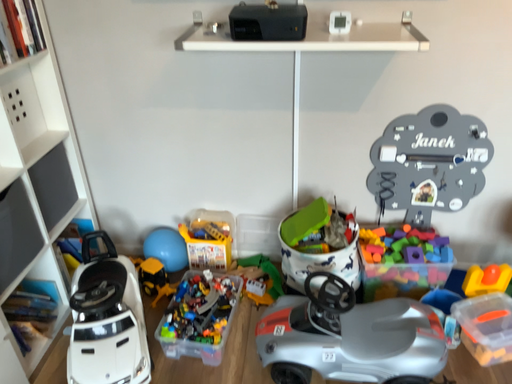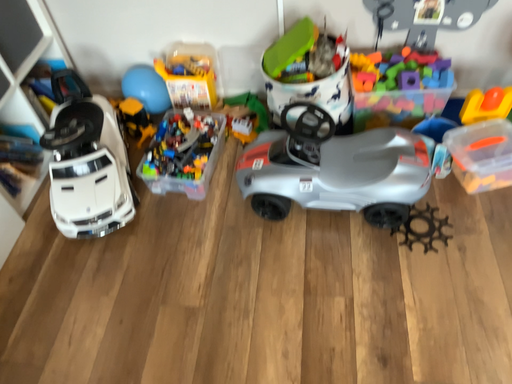
Question: How did the camera likely rotate when shooting the video?

Choices:
 (A) rotated upward
 (B) rotated downward

Answer: (B)